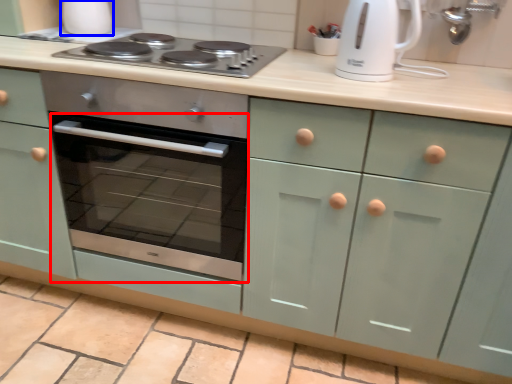
Question: Which object appears farthest to the camera in this image, oven (highlighted by a red box) or appliance (highlighted by a blue box)?

Choices:
 (A) oven
 (B) appliance

Answer: (B)